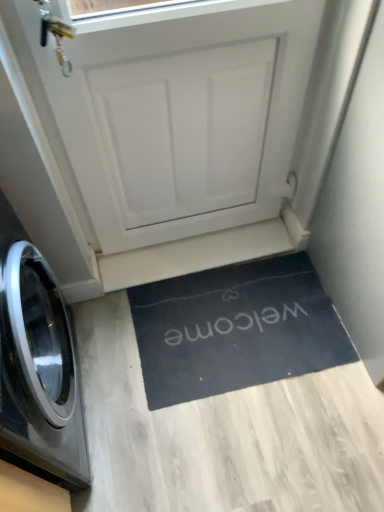
I want to click on free space above black rubber doormat at lower center (from a real-world perspective), so click(239, 322).